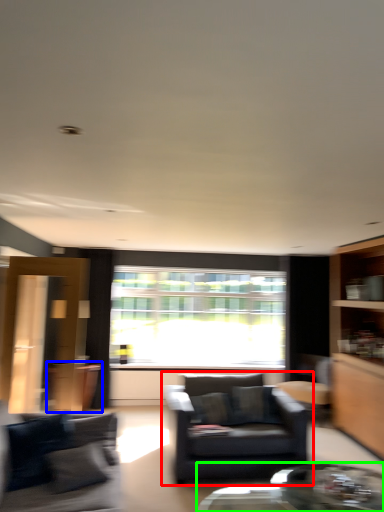
Question: Which object is the farthest from chair (highlighted by a red box)? Choose among these: cabinetry (highlighted by a blue box) or coffee table (highlighted by a green box).

Choices:
 (A) cabinetry
 (B) coffee table

Answer: (A)